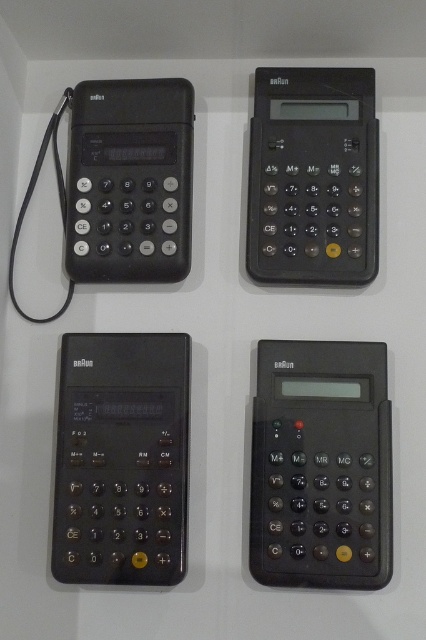
You are organizing a display of calculators and need to place the black plastic calculator at lower left and the black plastic calculator at upper right side by side. Which one should be placed on the left to ensure they fit within a 30 cm wide shelf?

The black plastic calculator at lower left has a smaller width than the black plastic calculator at upper right. Placing the smaller one on the left will allow both calculators to fit within the 30 cm shelf width more effectively.